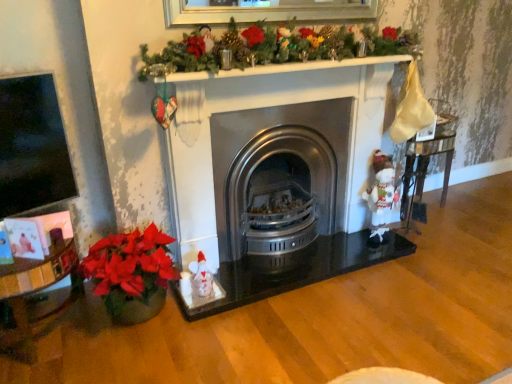
This screenshot has height=384, width=512. I want to click on vacant area that lies to the right of wooden glossy table at right, so [468, 214].